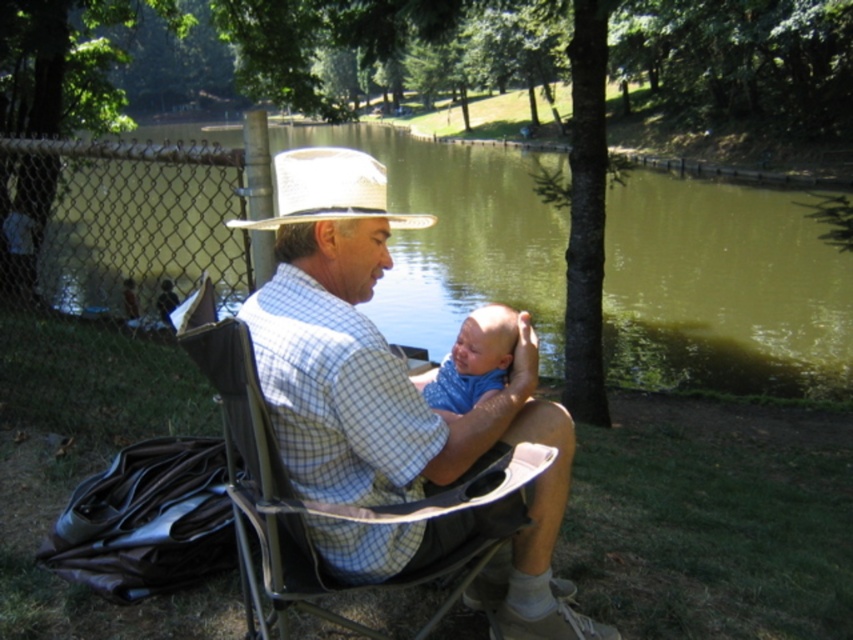
Consider the image. Is green water at center in front of plaid shirt at center?

That is False.

Based on the photo, which is more to the right, green water at center or plaid shirt at center?

plaid shirt at center is more to the right.

This screenshot has height=640, width=853. Find the location of `green water at center`. green water at center is located at coordinates (722, 291).

Locate an element on the screen. The width and height of the screenshot is (853, 640). green water at center is located at coordinates (722, 291).

Is green water at center positioned at the back of blue cotton bib at center?

Yes.

Who is lower down, green water at center or blue cotton bib at center?

Positioned lower is blue cotton bib at center.

Which is behind, point (650, 285) or point (491, 387)?

Positioned behind is point (650, 285).

Identify the location of green water at center. (722, 291).

Is point (383, 413) more distant than point (503, 312)?

No, (383, 413) is in front of (503, 312).

Which is above, plaid shirt at center or blue cotton bib at center?

plaid shirt at center

Who is more forward, (349, 310) or (497, 337)?

Point (349, 310)

Where is `plaid shirt at center`? The width and height of the screenshot is (853, 640). plaid shirt at center is located at coordinates (390, 385).